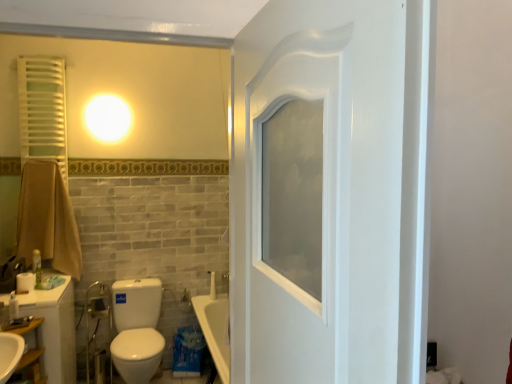
Find the location of a particular element. vacant region above white matte radiator at upper left (from a real-world perspective) is located at coordinates (41, 56).